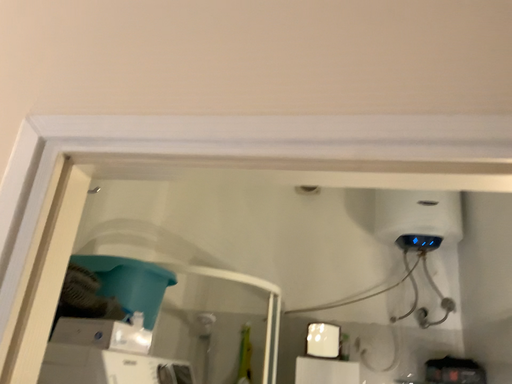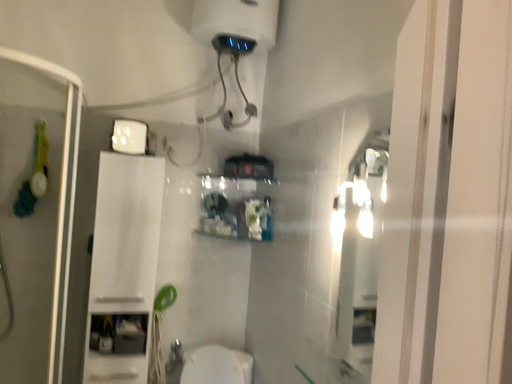
Question: How did the camera likely rotate when shooting the video?

Choices:
 (A) rotated right
 (B) rotated left

Answer: (A)